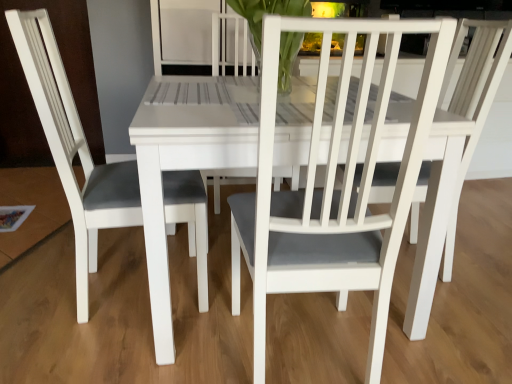
Question: Is white matte chair at center, which ranks as the second chair in left-to-right order, facing away from white matte chair at left, the second chair positioned from the right?

Choices:
 (A) yes
 (B) no

Answer: (B)

Question: Is white matte chair at center, which is the first chair from right to left, shorter than white matte chair at left, the second chair positioned from the right?

Choices:
 (A) yes
 (B) no

Answer: (A)

Question: Would you say white matte chair at left, the second chair positioned from the right, is part of white matte chair at center, which is the first chair from right to left,'s contents?

Choices:
 (A) yes
 (B) no

Answer: (B)

Question: Is white matte chair at center, which is the first chair from right to left, further to camera compared to white matte chair at left, the second chair positioned from the right?

Choices:
 (A) no
 (B) yes

Answer: (A)

Question: Considering the relative sizes of white matte chair at center, which ranks as the second chair in left-to-right order, and white matte chair at left, placed as the 1th chair when sorted from left to right, in the image provided, is white matte chair at center, which ranks as the second chair in left-to-right order, thinner than white matte chair at left, placed as the 1th chair when sorted from left to right,?

Choices:
 (A) no
 (B) yes

Answer: (A)

Question: From the image's perspective, is white matte chair at center, which is the first chair from right to left, located above white matte chair at left, placed as the 1th chair when sorted from left to right?

Choices:
 (A) no
 (B) yes

Answer: (A)

Question: Are clear glass vase at center and white matte chair at left, the second chair positioned from the right, beside each other?

Choices:
 (A) yes
 (B) no

Answer: (B)

Question: Is clear glass vase at center positioned behind white matte chair at left, the second chair positioned from the right?

Choices:
 (A) yes
 (B) no

Answer: (A)

Question: From a real-world perspective, is clear glass vase at center located beneath white matte chair at left, placed as the 1th chair when sorted from left to right?

Choices:
 (A) yes
 (B) no

Answer: (B)

Question: Considering the relative sizes of clear glass vase at center and white matte chair at left, the second chair positioned from the right, in the image provided, is clear glass vase at center shorter than white matte chair at left, the second chair positioned from the right,?

Choices:
 (A) yes
 (B) no

Answer: (A)

Question: Is clear glass vase at center closer to camera compared to white matte chair at left, the second chair positioned from the right?

Choices:
 (A) yes
 (B) no

Answer: (B)

Question: Does clear glass vase at center appear on the left side of white matte chair at left, placed as the 1th chair when sorted from left to right?

Choices:
 (A) yes
 (B) no

Answer: (B)

Question: From a real-world perspective, does white matte chair at left, the second chair positioned from the right, sit lower than white matte chair at center, which ranks as the second chair in left-to-right order?

Choices:
 (A) yes
 (B) no

Answer: (B)